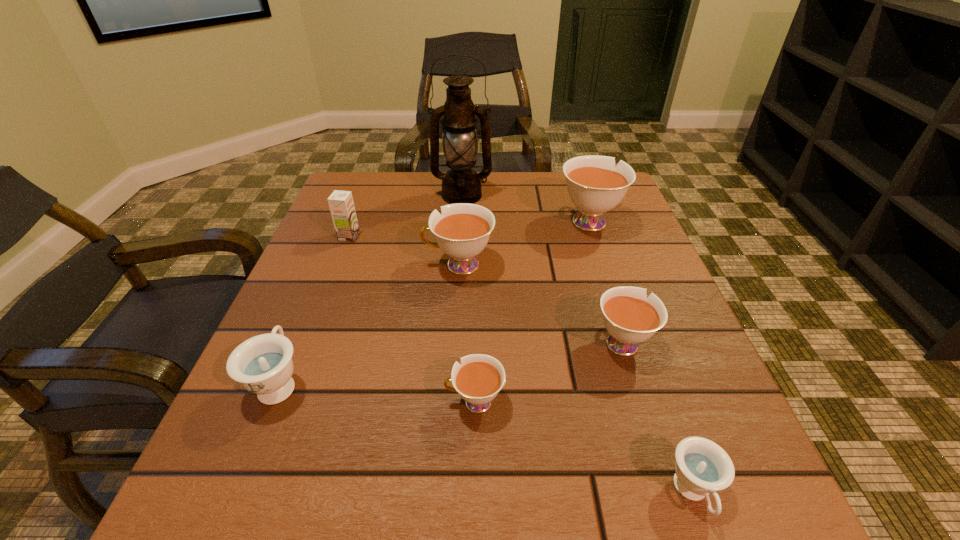
In order to click on the smallest white teacup in this screenshot , I will do `click(478, 379)`.

Where is `the nearer blue teacup`? the nearer blue teacup is located at coordinates (702, 467).

The image size is (960, 540). I want to click on the nearest teacup, so click(x=702, y=467).

At what (x,y) coordinates should I click in order to perform the action: click on vacant area situated on the right of the oil lamp. Please return your answer as a coordinate pair (x, y). The width and height of the screenshot is (960, 540). Looking at the image, I should click on (615, 195).

Identify the location of vacant space located on the side of the farthest white teacup with the handle. This screenshot has width=960, height=540. (574, 176).

At what (x,y) coordinates should I click in order to perform the action: click on vacant area situated on the right of the chocolate milk. Please return your answer as a coordinate pair (x, y). The image size is (960, 540). Looking at the image, I should click on (455, 237).

This screenshot has height=540, width=960. I want to click on vacant position located on the side of the second biggest white teacup with the handle, so click(x=300, y=265).

This screenshot has width=960, height=540. Identify the location of vacant area situated on the side of the second biggest white teacup with the handle. click(x=333, y=265).

At what (x,y) coordinates should I click in order to perform the action: click on free space located on the side of the second biggest white teacup with the handle. Please return your answer as a coordinate pair (x, y). Looking at the image, I should click on (385, 265).

The image size is (960, 540). In order to click on free space located on the side of the second smallest white teacup with the handle in this screenshot , I will do `click(590, 245)`.